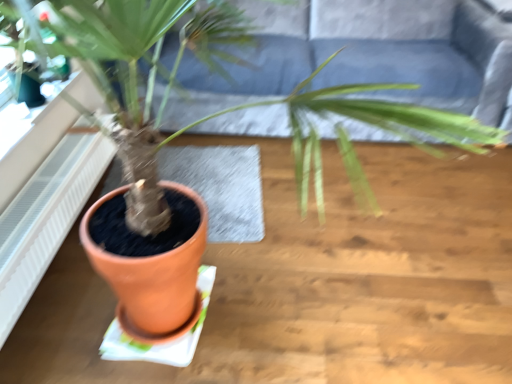
Describe the element at coordinates (46, 217) in the screenshot. I see `white textured radiator at left` at that location.

You are a GUI agent. You are given a task and a screenshot of the screen. Output one action in this format:
    pyautogui.click(x=<x>, y=<y>)
    Task: Click on the white textured radiator at left
    
    Given the screenshot: What is the action you would take?
    pyautogui.click(x=46, y=217)

In order to face white textured radiator at left, should I rotate leftwards or rightwards?

Rotate left and turn 25.058 degrees.

The width and height of the screenshot is (512, 384). What do you see at coordinates (370, 61) in the screenshot? I see `dark gray fabric couch at upper center` at bounding box center [370, 61].

In order to click on dark gray fabric couch at upper center in this screenshot , I will do `click(370, 61)`.

What is the approximate width of dark gray fabric couch at upper center?

dark gray fabric couch at upper center is 1.07 meters wide.

Where is `white textured radiator at left`? white textured radiator at left is located at coordinates (46, 217).

Visually, is white textured radiator at left positioned to the left or to the right of dark gray fabric couch at upper center?

In the image, white textured radiator at left appears on the left side of dark gray fabric couch at upper center.

Is white textured radiator at left in front of or behind dark gray fabric couch at upper center in the image?

Visually, white textured radiator at left is located in front of dark gray fabric couch at upper center.

Which is in front, point (79, 166) or point (387, 59)?

Positioned in front is point (79, 166).

From the image's perspective, is white textured radiator at left located beneath dark gray fabric couch at upper center?

Yes.

From the picture: From a real-world perspective, is white textured radiator at left above or below dark gray fabric couch at upper center?

From a real-world perspective, white textured radiator at left is physically below dark gray fabric couch at upper center.

Which of these two, white textured radiator at left or dark gray fabric couch at upper center, is wider?

dark gray fabric couch at upper center is wider.

Considering the sizes of objects white textured radiator at left and dark gray fabric couch at upper center in the image provided, who is taller, white textured radiator at left or dark gray fabric couch at upper center?

Standing taller between the two is dark gray fabric couch at upper center.

Is white textured radiator at left smaller than dark gray fabric couch at upper center?

Indeed, white textured radiator at left has a smaller size compared to dark gray fabric couch at upper center.

Is white textured radiator at left surrounding dark gray fabric couch at upper center?

No, white textured radiator at left does not contain dark gray fabric couch at upper center.

Is white textured radiator at left not close to dark gray fabric couch at upper center?

That's right, there is a large distance between white textured radiator at left and dark gray fabric couch at upper center.

Is white textured radiator at left oriented towards dark gray fabric couch at upper center?

No, white textured radiator at left does not turn towards dark gray fabric couch at upper center.

How many degrees apart are the facing directions of white textured radiator at left and dark gray fabric couch at upper center?

There is a 89.3-degree angle between the facing directions of white textured radiator at left and dark gray fabric couch at upper center.

How far apart are white textured radiator at left and dark gray fabric couch at upper center?

They are 3.89 feet apart.

Find the location of `couch above the white textured radiator at left (from the image's perspective)`. couch above the white textured radiator at left (from the image's perspective) is located at coordinates (370, 61).

Considering the relative positions of dark gray fabric couch at upper center and white textured radiator at left in the image provided, is dark gray fabric couch at upper center to the left or to the right of white textured radiator at left?

Based on their positions, dark gray fabric couch at upper center is located to the right of white textured radiator at left.

Between dark gray fabric couch at upper center and white textured radiator at left, which one is positioned behind?

dark gray fabric couch at upper center is more distant.

Between point (316, 22) and point (9, 327), which one is positioned in front?

The point (9, 327) is more forward.

From the image's perspective, between dark gray fabric couch at upper center and white textured radiator at left, who is located below?

white textured radiator at left, from the image's perspective.

From a real-world perspective, is dark gray fabric couch at upper center above or below white textured radiator at left?

dark gray fabric couch at upper center is situated higher than white textured radiator at left in the real world.

Which of these two, dark gray fabric couch at upper center or white textured radiator at left, is thinner?

white textured radiator at left is thinner.

Between dark gray fabric couch at upper center and white textured radiator at left, which one has less height?

With less height is white textured radiator at left.

Considering the relative sizes of dark gray fabric couch at upper center and white textured radiator at left in the image provided, is dark gray fabric couch at upper center smaller than white textured radiator at left?

Actually, dark gray fabric couch at upper center might be larger than white textured radiator at left.

Is dark gray fabric couch at upper center situated inside white textured radiator at left or outside?

dark gray fabric couch at upper center lies outside white textured radiator at left.

Is the surface of dark gray fabric couch at upper center in direct contact with white textured radiator at left?

There is a gap between dark gray fabric couch at upper center and white textured radiator at left.

Is dark gray fabric couch at upper center facing away from white textured radiator at left?

dark gray fabric couch at upper center does not have its back to white textured radiator at left.

Find the location of a particular element. The height and width of the screenshot is (384, 512). couch behind the white textured radiator at left is located at coordinates (370, 61).

The height and width of the screenshot is (384, 512). Find the location of `radiator lying on the left of dark gray fabric couch at upper center`. radiator lying on the left of dark gray fabric couch at upper center is located at coordinates (46, 217).

Where is `couch above the white textured radiator at left (from the image's perspective)`? This screenshot has width=512, height=384. couch above the white textured radiator at left (from the image's perspective) is located at coordinates (370, 61).